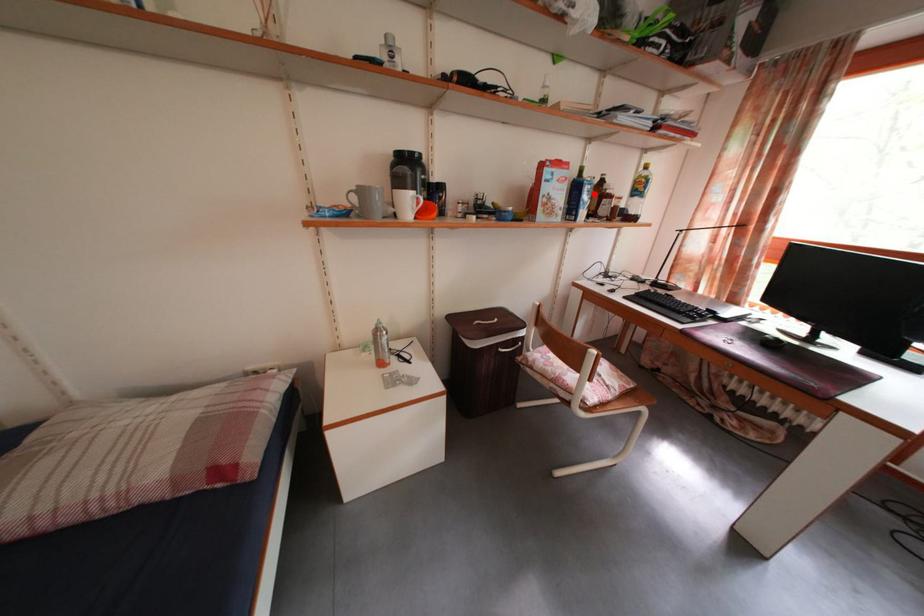
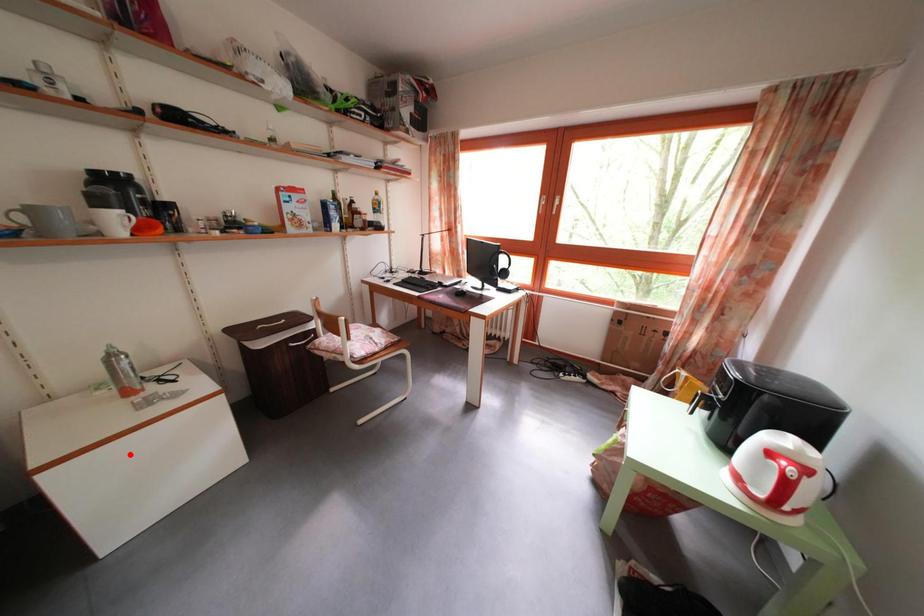
I am providing you with two images of the same scene from different viewpoints. A red point is marked on the first image and another point is marked on the second image. Does the point marked in image1 correspond to the same location as the one in image2?

No